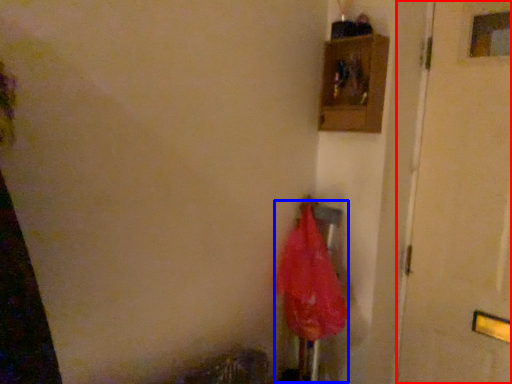
Question: Which object appears closest to the camera in this image, door (highlighted by a red box) or umbrella (highlighted by a blue box)?

Choices:
 (A) door
 (B) umbrella

Answer: (A)